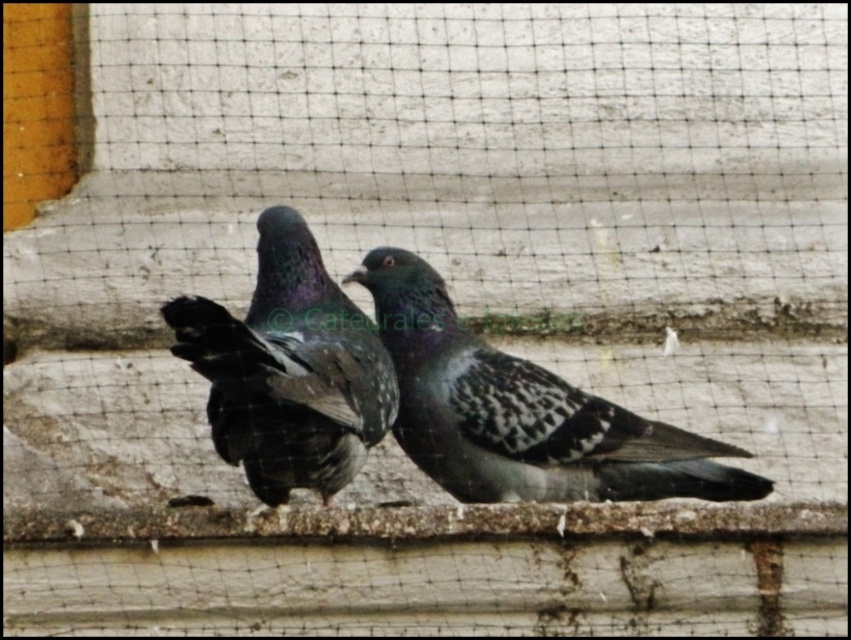
Does speckled feathered pigeon at center have a lesser height compared to shiny dark feathers at center?

Yes, speckled feathered pigeon at center is shorter than shiny dark feathers at center.

Is speckled feathered pigeon at center bigger than shiny dark feathers at center?

No.

Locate an element on the screen. speckled feathered pigeon at center is located at coordinates (523, 412).